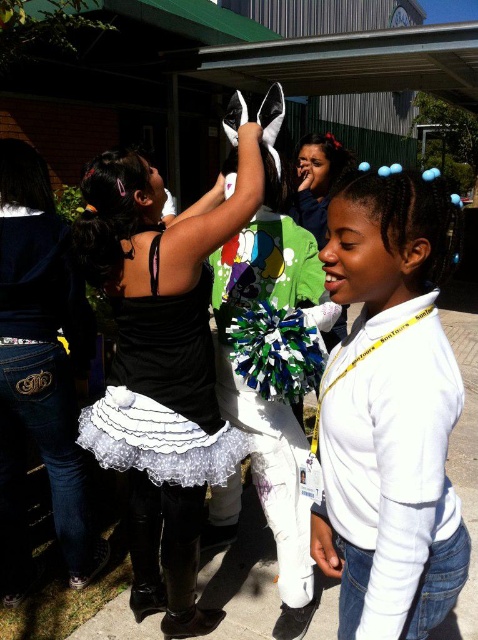
Is denim jeans at lower left further to camera compared to white lace dress at center?

That is True.

Is denim jeans at lower left to the right of white lace dress at center from the viewer's perspective?

No, denim jeans at lower left is not to the right of white lace dress at center.

At what (x,y) coordinates should I click in order to perform the action: click on denim jeans at lower left. Please return your answer as a coordinate pair (x, y). This screenshot has height=640, width=478. Looking at the image, I should click on (41, 369).

Is white matte hairband at upper right thinner than black satin tutu at center?

Correct, white matte hairband at upper right's width is less than black satin tutu at center's.

Based on the photo, can you confirm if white matte hairband at upper right is positioned to the right of black satin tutu at center?

Yes, white matte hairband at upper right is to the right of black satin tutu at center.

Who is more forward, (355,580) or (205,214)?

Point (355,580)

I want to click on white matte hairband at upper right, so click(390, 413).

Is white matte hairband at upper right shorter than white lace dress at center?

In fact, white matte hairband at upper right may be taller than white lace dress at center.

Is white matte hairband at upper right smaller than white lace dress at center?

Yes.

Which is in front, point (362, 406) or point (182, 477)?

Point (362, 406) is in front.

Image resolution: width=478 pixels, height=640 pixels. I want to click on white matte hairband at upper right, so click(x=390, y=413).